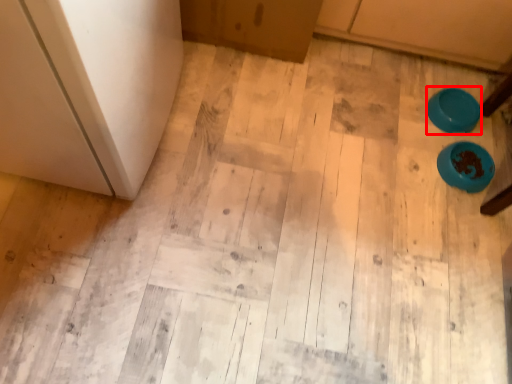
Question: From the image's perspective, where is bowl (annotated by the red box) located relative to bowl?

Choices:
 (A) below
 (B) above

Answer: (B)